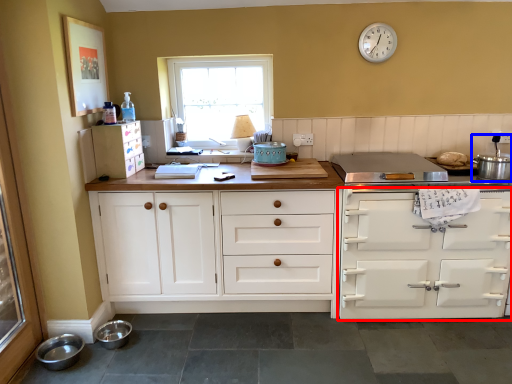
Question: Which object appears closest to the camera in this image, cabinetry (highlighted by a red box) or appliance (highlighted by a blue box)?

Choices:
 (A) cabinetry
 (B) appliance

Answer: (B)